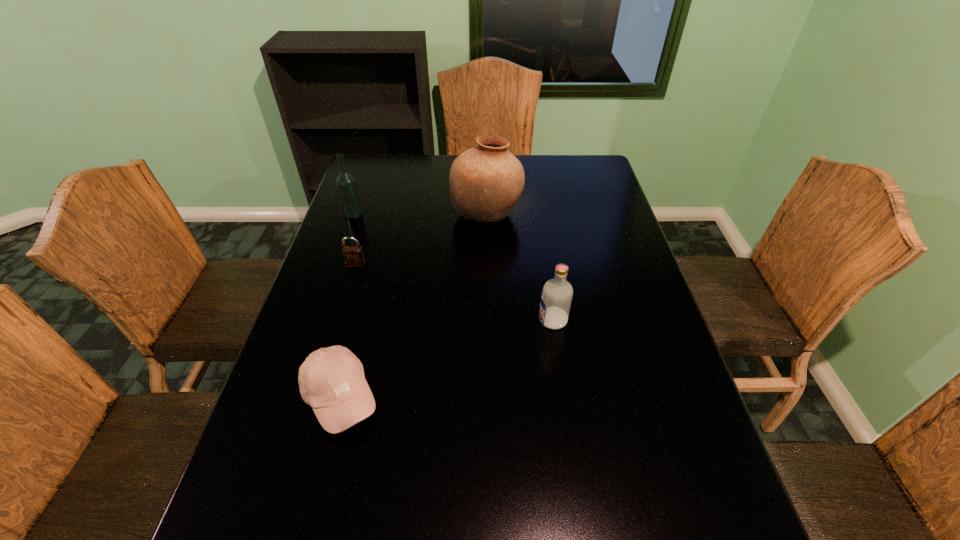
This screenshot has height=540, width=960. Identify the location of free point between the third nearest object and the nearest object. (348, 330).

Locate which object is the second closest to the rightmost object. Please provide its 2D coordinates. Your answer should be formatted as a tuple, i.e. [(x, y)], where the tuple contains the x and y coordinates of a point satisfying the conditions above.

[(331, 380)]

Locate an element on the screen. The height and width of the screenshot is (540, 960). object that can be found as the second closest to the third farthest object is located at coordinates (486, 181).